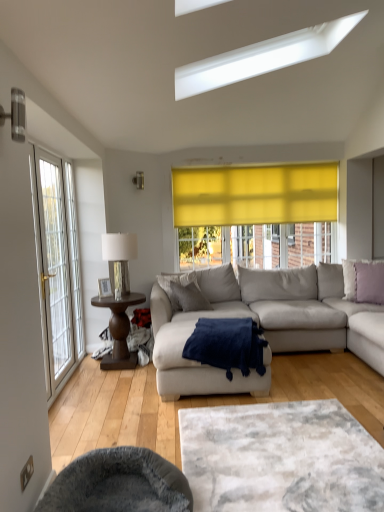
Question: Considering their positions, is white glass door at left located in front of or behind lavender fabric pillow at right, which is the first pillow from right to left?

Choices:
 (A) behind
 (B) front

Answer: (B)

Question: Is white glass door at left bigger or smaller than lavender fabric pillow at right, the second pillow in the left-to-right sequence?

Choices:
 (A) small
 (B) big

Answer: (B)

Question: Considering the real-world distances, which object is farthest from the gray fabric pillow at center, the 1th pillow from the left?

Choices:
 (A) metallic silver lamp at upper center
 (B) navy blue plush blanket at center
 (C) lavender fabric pillow at right, the second pillow in the left-to-right sequence
 (D) light gray fabric couch at center
 (E) dark brown wooden side table at left

Answer: (C)

Question: Which of these objects is positioned closest to the dark brown wooden side table at left?

Choices:
 (A) navy blue plush blanket at center
 (B) gray fabric pillow at center, which ranks as the second pillow in right-to-left order
 (C) white textured rug at center
 (D) metallic silver lamp at upper center
 (E) velvet grey swivel chair at lower left

Answer: (B)